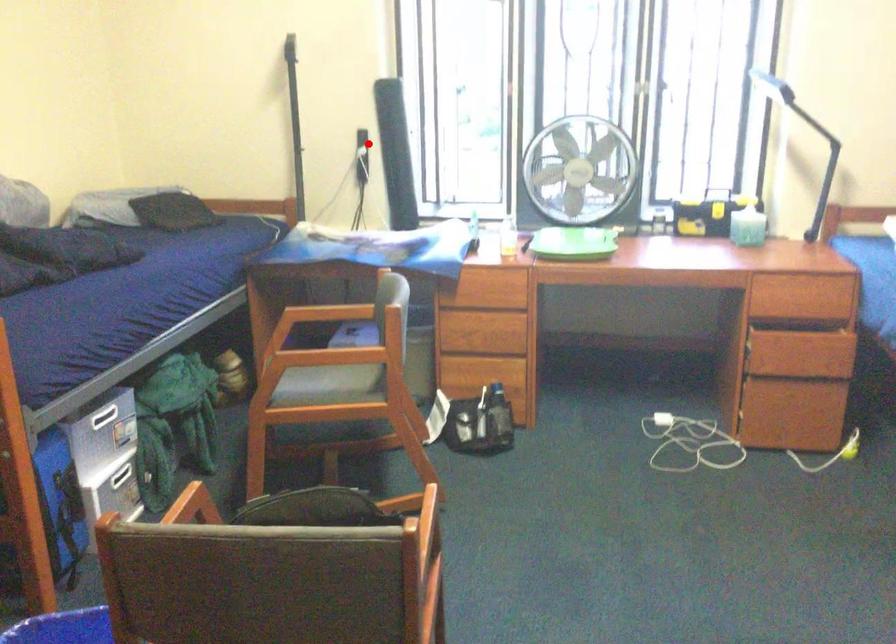
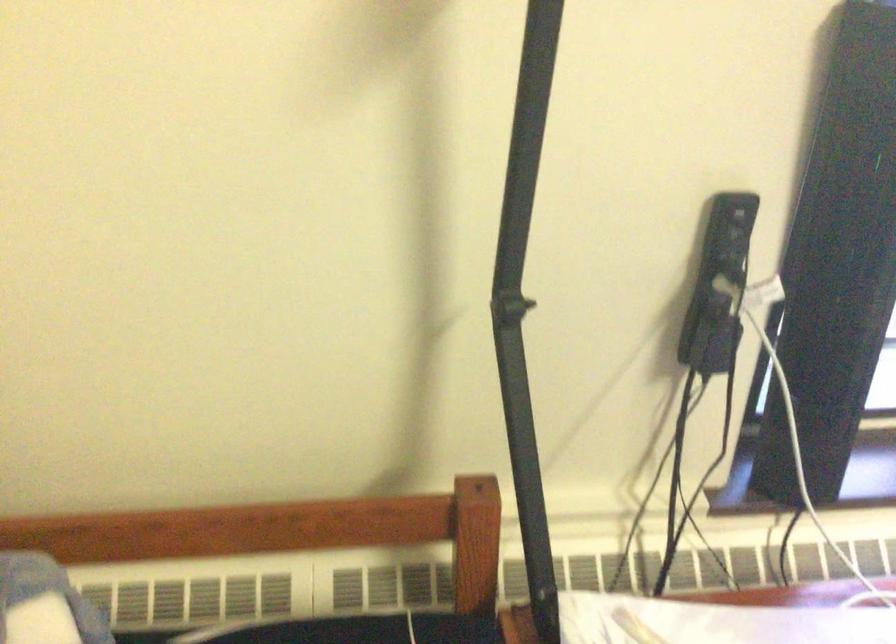
Where in the second image is the point corresponding to the highlighted location from the first image?

(718, 285)